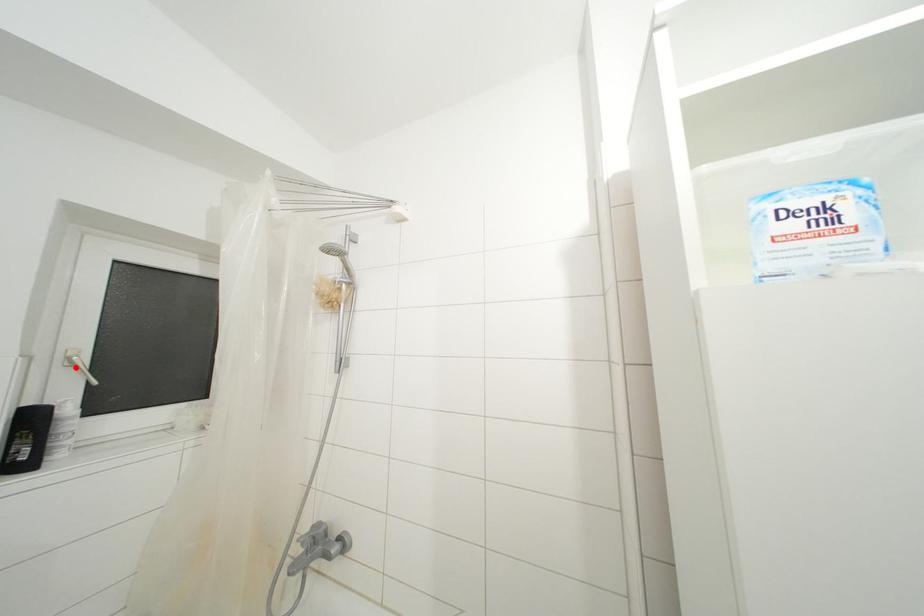
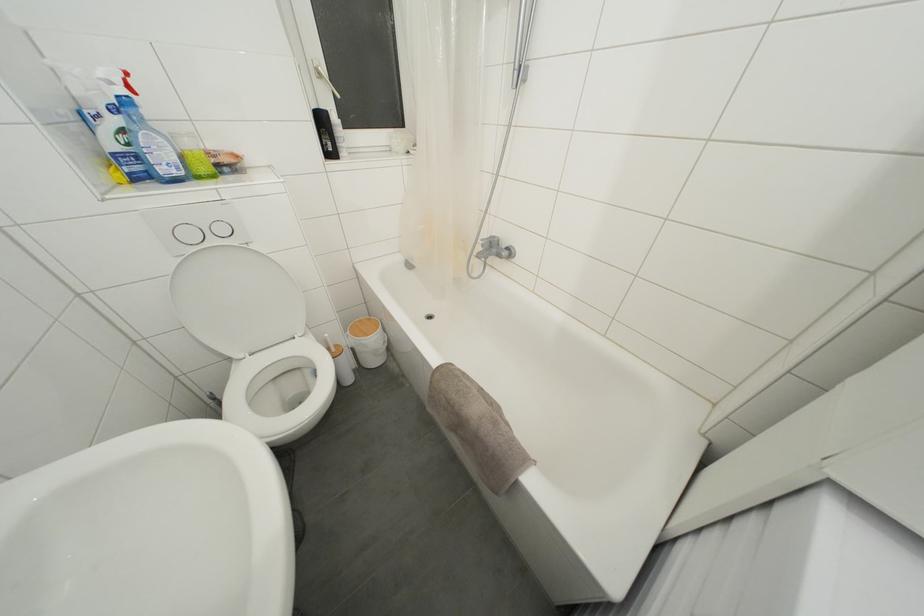
In the second image, find the point that corresponds to the highlighted location in the first image.

(323, 79)